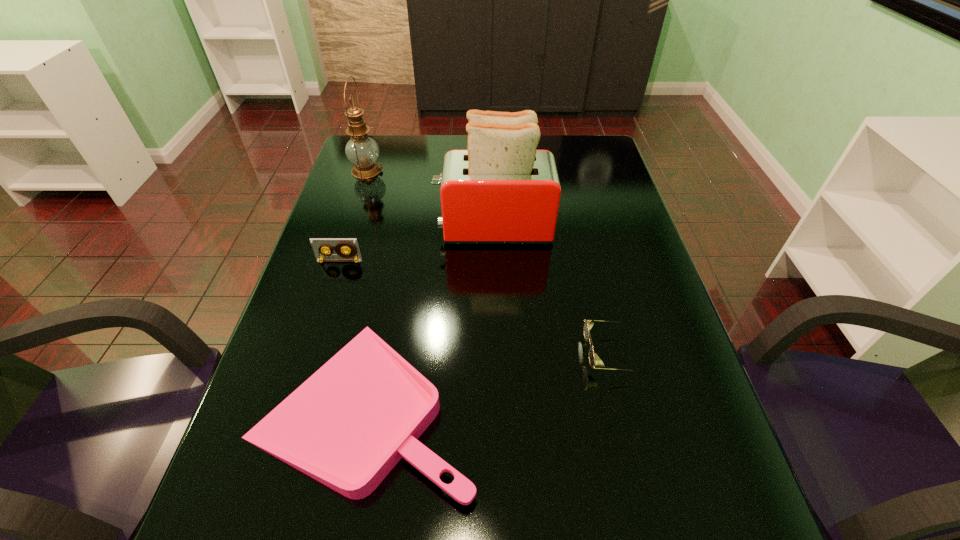
Find the location of a particular element. This screenshot has width=960, height=540. vacant space located on the right of the oil lamp is located at coordinates (435, 171).

Identify the location of vacant space situated at the front of the videotape with visible reels. The width and height of the screenshot is (960, 540). (306, 367).

This screenshot has height=540, width=960. Identify the location of free space located on the front lenses of the second shortest object. (553, 354).

Identify the location of vacant space located on the front lenses of the second shortest object. The image size is (960, 540). (454, 354).

You are a GUI agent. You are given a task and a screenshot of the screen. Output one action in this format:
    pyautogui.click(x=<x>, y=<y>)
    Task: Click on the free space located 0.080m on the front lenses of the second shortest object
    
    Given the screenshot: What is the action you would take?
    pyautogui.click(x=548, y=354)

This screenshot has width=960, height=540. In order to click on object present at the far edge in this screenshot , I will do `click(361, 150)`.

Where is `oil lamp present at the left edge`? The height and width of the screenshot is (540, 960). oil lamp present at the left edge is located at coordinates (361, 150).

Locate an element on the screen. The image size is (960, 540). videotape at the left edge is located at coordinates (319, 245).

Where is `dustpan that is positioned at the left edge`? The height and width of the screenshot is (540, 960). dustpan that is positioned at the left edge is located at coordinates (347, 426).

Find the location of a particular element. object positioned at the right edge is located at coordinates (594, 360).